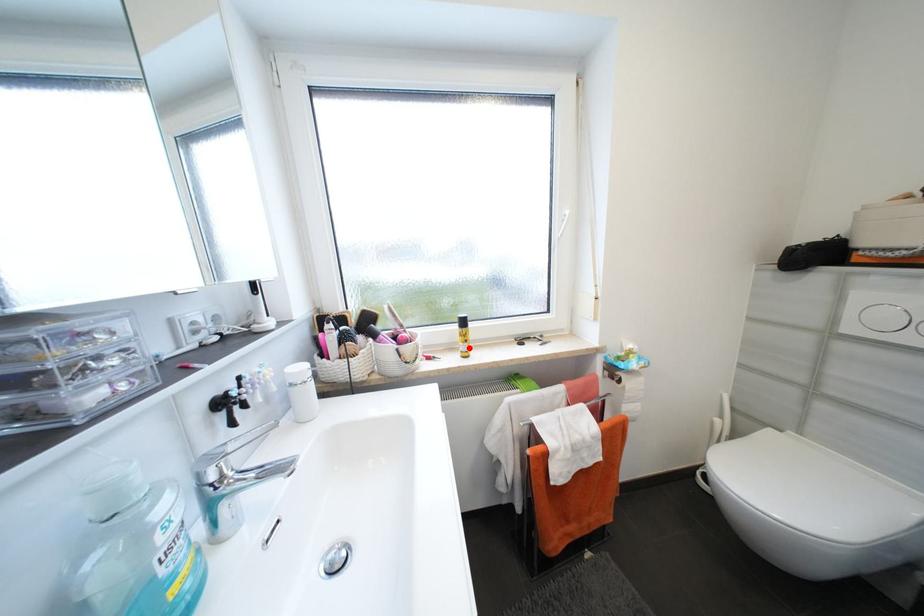
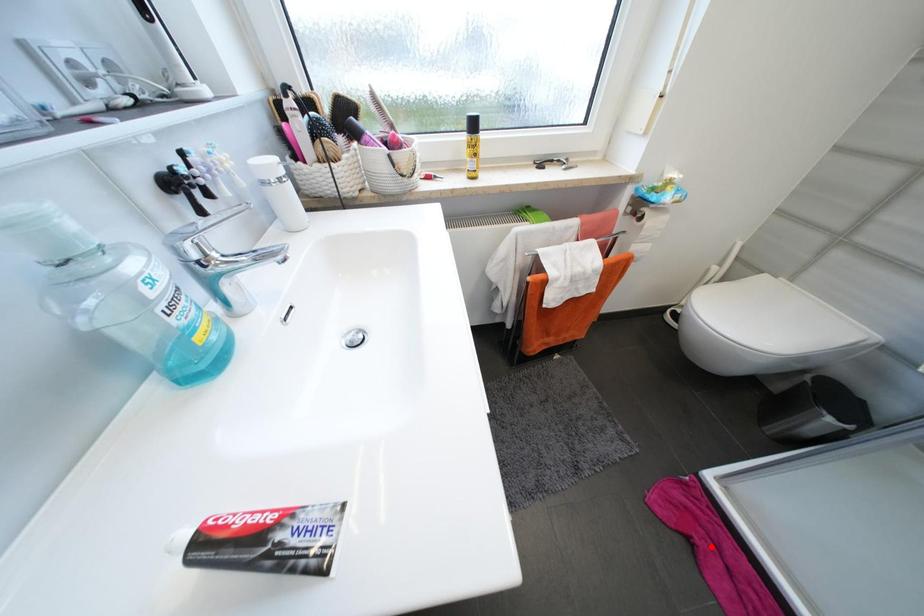
I am providing you with two images of the same scene from different viewpoints. A red point is marked on the first image and another point is marked on the second image. Is the marked point in image1 the same physical position as the marked point in image2?

No